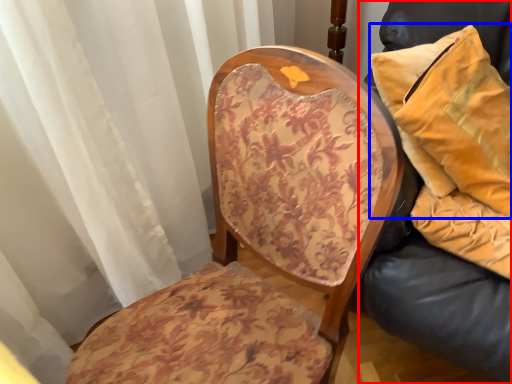
Question: Which object is further to the camera taking this photo, furniture (highlighted by a red box) or pillow (highlighted by a blue box)?

Choices:
 (A) furniture
 (B) pillow

Answer: (B)